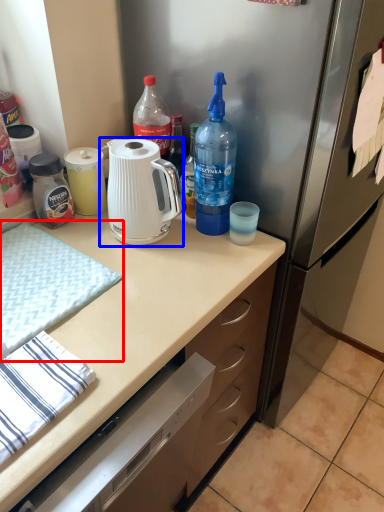
Question: Which of the following is the farthest to the observer, hand towel (highlighted by a red box) or kettle (highlighted by a blue box)?

Choices:
 (A) hand towel
 (B) kettle

Answer: (B)